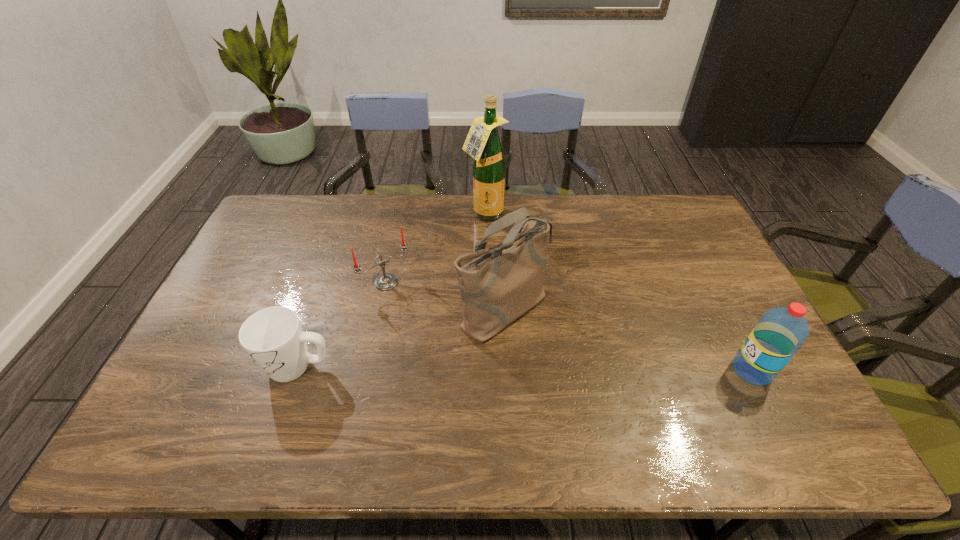
Identify the location of vacant area situated on the front-facing side of the second tallest object. Image resolution: width=960 pixels, height=540 pixels. (606, 384).

The height and width of the screenshot is (540, 960). Identify the location of object that is at the far edge. pyautogui.click(x=483, y=143).

At what (x,y) coordinates should I click in order to perform the action: click on mug at the near edge. Please return your answer as a coordinate pair (x, y). The image size is (960, 540). Looking at the image, I should click on pos(273,337).

Locate an element on the screen. This screenshot has width=960, height=540. water bottle positioned at the near edge is located at coordinates (780, 332).

Locate an element on the screen. object that is at the right edge is located at coordinates [780, 332].

Find the location of a particular element. Image resolution: width=960 pixels, height=540 pixels. object located at the near right corner is located at coordinates (780, 332).

The image size is (960, 540). In the image, there is a desktop. Identify the location of free space at the far edge. (550, 223).

Where is `vacant region at the near edge of the desktop`? vacant region at the near edge of the desktop is located at coordinates (228, 407).

You are a GUI agent. You are given a task and a screenshot of the screen. Output one action in this format:
    pyautogui.click(x=<x>, y=<y>)
    Task: Click on the vacant area at the left edge of the desktop
    This screenshot has width=960, height=540.
    Given the screenshot: What is the action you would take?
    pyautogui.click(x=219, y=311)

Locate an element on the screen. The height and width of the screenshot is (540, 960). free space at the right edge of the desktop is located at coordinates (715, 266).